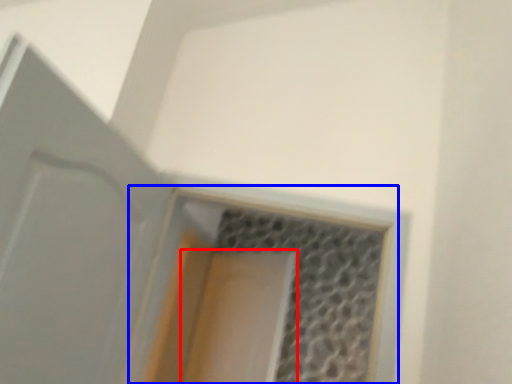
Question: Among these objects, which one is nearest to the camera, screen door (highlighted by a red box) or window (highlighted by a blue box)?

Choices:
 (A) screen door
 (B) window

Answer: (B)